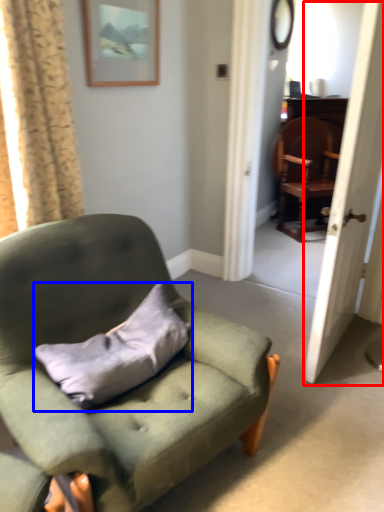
Question: Which object appears closest to the camera in this image, screen door (highlighted by a red box) or pillow (highlighted by a blue box)?

Choices:
 (A) screen door
 (B) pillow

Answer: (B)